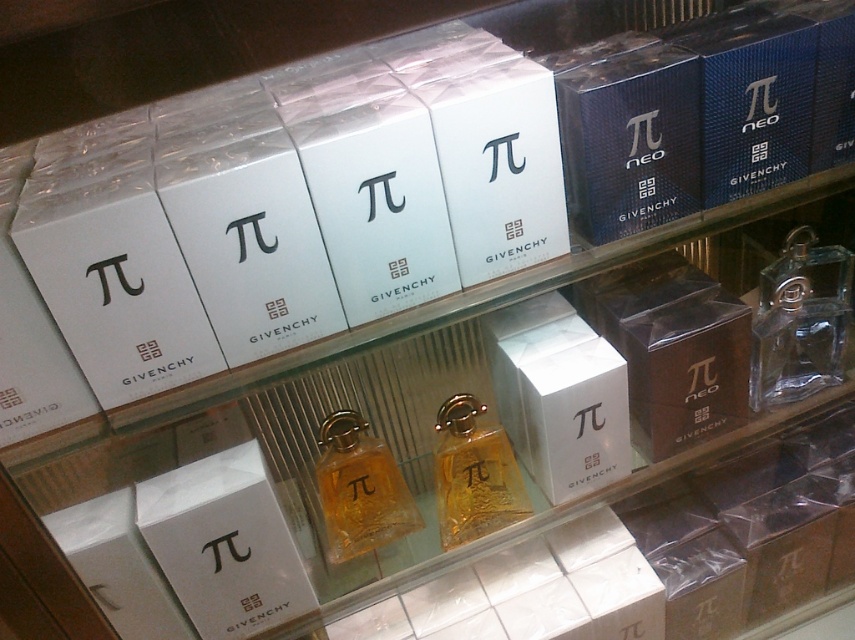
You are a customer in the store looking at the perfume display. There are two points marked on the display. The first point is at coordinate point (771, 371) and the second is at point (402, 497). From your perspective, which point is closer to you?

Point (402, 497) is closer to you because it is in front of point (771, 371).

You are a customer in the store and want to find the clear glass perfume at center. According to the store layout, where should you look relative to the shelves?

The clear glass perfume at center is located at the bottom shelf since its 2D coordinates are at point (799, 321), which places it near the lower part of the image.